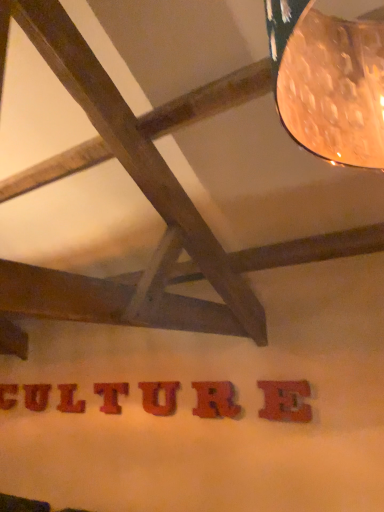
What do you see at coordinates (285, 401) in the screenshot? The height and width of the screenshot is (512, 384). I see `matte red letter e at center, which is the first letter from front to back` at bounding box center [285, 401].

The height and width of the screenshot is (512, 384). I want to click on wooden textured letter t at center, which is the fourth letter in front-to-back order, so click(111, 396).

Measure the distance between point (102, 389) and camera.

The distance of point (102, 389) from camera is 11.58 feet.

How much space does red wood letter at center, which appears as the 3th letter when viewed from the back, occupy vertically?

The height of red wood letter at center, which appears as the 3th letter when viewed from the back, is 10.92 inches.

What do you see at coordinates (70, 400) in the screenshot? This screenshot has height=512, width=384. I see `red wood letter at center, acting as the fifth letter starting from the front` at bounding box center [70, 400].

Locate an element on the screen. The width and height of the screenshot is (384, 512). red wood letter at lower center, placed as the 7th letter when sorted from front to back is located at coordinates (8, 396).

Locate an element on the screen. rubberized red letter r at center, acting as the 6th letter starting from the back is located at coordinates (215, 400).

Is red wood letter at center, arranged as the 2th letter when viewed from the back, facing towards matte red letter e at center, the 1th letter from the right?

No.

You are a GUI agent. You are given a task and a screenshot of the screen. Output one action in this format:
    pyautogui.click(x=<x>, y=<y>)
    Task: Click on the 5th letter counting from the left side of the matte red letter e at center, which is the seventh letter in back-to-front order
    Image resolution: width=384 pixels, height=512 pixels.
    Given the screenshot: What is the action you would take?
    pyautogui.click(x=36, y=396)

From their relative heights in the image, would you say red wood letter at center, arranged as the 6th letter when viewed from the right, is taller or shorter than matte red letter e at center, which is the seventh letter in back-to-front order?

Clearly, red wood letter at center, arranged as the 6th letter when viewed from the right, is shorter compared to matte red letter e at center, which is the seventh letter in back-to-front order.

Can you tell me how much red wood letter at center, the sixth letter viewed from the front, and matte red letter e at center, which is the seventh letter in back-to-front order, differ in facing direction?

The facing directions of red wood letter at center, the sixth letter viewed from the front, and matte red letter e at center, which is the seventh letter in back-to-front order, are 0.00412 degrees apart.

Is point (156, 415) closer to camera compared to point (38, 403)?

Yes.

At what (x,y) coordinates should I click in order to perform the action: click on letter that is the 3rd one when counting leftward from the wooden letter u at center, acting as the third letter starting from the front. Please return your answer as a coordinate pair (x, y). Image resolution: width=384 pixels, height=512 pixels. Looking at the image, I should click on (36, 396).

Does wooden letter u at center, acting as the 5th letter starting from the back, have a lesser height compared to red wood letter at center, the sixth letter viewed from the front?

Incorrect, the height of wooden letter u at center, acting as the 5th letter starting from the back, does not fall short of that of red wood letter at center, the sixth letter viewed from the front.

Could red wood letter at center, arranged as the 2th letter when viewed from the back, be considered to be inside wooden letter u at center, the fifth letter viewed from the left?

No, red wood letter at center, arranged as the 2th letter when viewed from the back, is not surrounded by wooden letter u at center, the fifth letter viewed from the left.

In the scene shown: Which object is further away from the camera taking this photo, matte red letter e at center, which is counted as the 7th letter, starting from the left, or red wood letter at center, the 3th letter when ordered from left to right?

red wood letter at center, the 3th letter when ordered from left to right.

Is matte red letter e at center, the 1th letter from the right, turned away from red wood letter at center, which is the 5th letter in right-to-left order?

That's not correct — matte red letter e at center, the 1th letter from the right, is not looking away from red wood letter at center, which is the 5th letter in right-to-left order.

In the image, is matte red letter e at center, which is the seventh letter in back-to-front order, on the left side or the right side of red wood letter at center, the 3th letter when ordered from left to right?

Based on their positions, matte red letter e at center, which is the seventh letter in back-to-front order, is located to the right of red wood letter at center, the 3th letter when ordered from left to right.

Looking at this image, considering their positions, is wooden textured letter t at center, which is the fourth letter in front-to-back order, located in front of or behind red wood letter at center, acting as the fifth letter starting from the front?

Clearly, wooden textured letter t at center, which is the fourth letter in front-to-back order, is in front of red wood letter at center, acting as the fifth letter starting from the front.

Based on the photo, from a real-world perspective, relative to red wood letter at center, which appears as the 3th letter when viewed from the back, is wooden textured letter t at center, which is the fourth letter in front-to-back order, vertically above or below?

Clearly, from a real-world perspective, wooden textured letter t at center, which is the fourth letter in front-to-back order, is above red wood letter at center, which appears as the 3th letter when viewed from the back.

Considering the sizes of objects wooden textured letter t at center, which appears as the 4th letter when viewed from the left, and red wood letter at center, which is the 5th letter in right-to-left order, in the image provided, who is wider, wooden textured letter t at center, which appears as the 4th letter when viewed from the left, or red wood letter at center, which is the 5th letter in right-to-left order,?

With larger width is red wood letter at center, which is the 5th letter in right-to-left order.

Are red wood letter at lower center, marked as the first letter in a back-to-front arrangement, and red wood letter at center, the sixth letter viewed from the front, far apart?

No, red wood letter at lower center, marked as the first letter in a back-to-front arrangement, is not far away from red wood letter at center, the sixth letter viewed from the front.

Would you say red wood letter at lower center, marked as the first letter in a back-to-front arrangement, is outside red wood letter at center, arranged as the 6th letter when viewed from the right?

Yes, red wood letter at lower center, marked as the first letter in a back-to-front arrangement, is outside of red wood letter at center, arranged as the 6th letter when viewed from the right.

In order to click on letter below the red wood letter at center, arranged as the 6th letter when viewed from the right (from the image's perspective) in this screenshot , I will do `click(8, 396)`.

Based on the photo, can you confirm if matte red letter e at center, which is the seventh letter in back-to-front order, is smaller than wooden letter u at center, acting as the 5th letter starting from the back?

No, matte red letter e at center, which is the seventh letter in back-to-front order, is not smaller than wooden letter u at center, acting as the 5th letter starting from the back.

Is matte red letter e at center, the 1th letter from the right, positioned beyond the bounds of wooden letter u at center, acting as the third letter starting from the front?

Yes.

Which is more to the left, matte red letter e at center, which is counted as the 7th letter, starting from the left, or wooden letter u at center, acting as the 5th letter starting from the back?

wooden letter u at center, acting as the 5th letter starting from the back, is more to the left.

Considering the relative positions of matte red letter e at center, which is counted as the 7th letter, starting from the left, and wooden letter u at center, acting as the third letter starting from the front, in the image provided, is matte red letter e at center, which is counted as the 7th letter, starting from the left, in front of wooden letter u at center, acting as the third letter starting from the front,?

Yes, it is in front of wooden letter u at center, acting as the third letter starting from the front.

Is wooden textured letter t at center, which is the fourth letter in front-to-back order, taller than red wood letter at lower center, the 7th letter positioned from the right?

Indeed, wooden textured letter t at center, which is the fourth letter in front-to-back order, has a greater height compared to red wood letter at lower center, the 7th letter positioned from the right.

Looking at this image, can you confirm if wooden textured letter t at center, which appears as the 4th letter when viewed from the left, is bigger than red wood letter at lower center, placed as the 7th letter when sorted from front to back?

Incorrect, wooden textured letter t at center, which appears as the 4th letter when viewed from the left, is not larger than red wood letter at lower center, placed as the 7th letter when sorted from front to back.

From a real-world perspective, who is located lower, wooden textured letter t at center, which ranks as the 4th letter in right-to-left order, or red wood letter at lower center, placed as the 7th letter when sorted from front to back?

From a 3D spatial view, red wood letter at lower center, placed as the 7th letter when sorted from front to back, is below.

Could you measure the distance between wooden textured letter t at center, which appears as the 4th letter when viewed from the left, and red wood letter at lower center, placed as the 7th letter when sorted from front to back?

1.21 meters.

From the matte red letter e at center, which is counted as the 7th letter, starting from the left, count the 5th letter to the left and point to it. Please provide its 2D coordinates.

[(36, 396)]

From the red wood letter at center, marked as the second letter in a left-to-right arrangement, count 3rd letters forward and point to it. Please provide its 2D coordinates.

[(159, 397)]

Consider the image. Estimate the real-world distances between objects in this image. Which object is further from rubberized red letter r at center, acting as the 6th letter starting from the left, matte red letter e at center, which is counted as the 7th letter, starting from the left, or wooden letter u at center, acting as the 5th letter starting from the back?

The object further to rubberized red letter r at center, acting as the 6th letter starting from the left, is matte red letter e at center, which is counted as the 7th letter, starting from the left.

Based on the photo, estimate the real-world distances between objects in this image. Which object is closer to red wood letter at lower center, marked as the first letter in a back-to-front arrangement, red wood letter at center, the 3th letter when ordered from left to right, or rubberized red letter r at center, acting as the 6th letter starting from the left?

red wood letter at center, the 3th letter when ordered from left to right.

Looking at the image, which one is located closer to wooden letter u at center, the fifth letter viewed from the left, red wood letter at center, marked as the second letter in a left-to-right arrangement, or red wood letter at center, which appears as the 3th letter when viewed from the back?

red wood letter at center, which appears as the 3th letter when viewed from the back, is closer to wooden letter u at center, the fifth letter viewed from the left.

Based on their spatial positions, is red wood letter at lower center, placed as the 7th letter when sorted from front to back, or red wood letter at center, which is the 5th letter in right-to-left order, further from red wood letter at center, the sixth letter viewed from the front?

red wood letter at lower center, placed as the 7th letter when sorted from front to back, is positioned further to the anchor red wood letter at center, the sixth letter viewed from the front.

Which object lies nearer to the anchor point red wood letter at lower center, the 1th letter from the left, rubberized red letter r at center, the second letter positioned from the front, or matte red letter e at center, the 1th letter from the right?

rubberized red letter r at center, the second letter positioned from the front.

Considering their positions, is red wood letter at center, acting as the fifth letter starting from the front, positioned closer to wooden textured letter t at center, which appears as the 4th letter when viewed from the left, than rubberized red letter r at center, which appears as the 2th letter when viewed from the right?

Among the two, red wood letter at center, acting as the fifth letter starting from the front, is located nearer to wooden textured letter t at center, which appears as the 4th letter when viewed from the left.

Considering their positions, is rubberized red letter r at center, the second letter positioned from the front, positioned closer to red wood letter at lower center, marked as the first letter in a back-to-front arrangement, than red wood letter at center, which appears as the 3th letter when viewed from the back?

Based on the image, red wood letter at center, which appears as the 3th letter when viewed from the back, appears to be nearer to red wood letter at lower center, marked as the first letter in a back-to-front arrangement.

From the image, which object appears to be farther from red wood letter at center, the sixth letter viewed from the front, matte red letter e at center, the 1th letter from the right, or red wood letter at center, which is the 5th letter in right-to-left order?

Based on the image, matte red letter e at center, the 1th letter from the right, appears to be further to red wood letter at center, the sixth letter viewed from the front.

Locate an element on the screen. letter between red wood letter at center, arranged as the 6th letter when viewed from the right, and wooden textured letter t at center, which ranks as the 4th letter in right-to-left order is located at coordinates (70, 400).

The width and height of the screenshot is (384, 512). I want to click on letter between wooden letter u at center, acting as the 5th letter starting from the back, and matte red letter e at center, which is counted as the 7th letter, starting from the left, so click(215, 400).

This screenshot has width=384, height=512. In order to click on letter between red wood letter at center, which appears as the 3th letter when viewed from the back, and wooden letter u at center, marked as the 3th letter in a right-to-left arrangement, from left to right in this screenshot , I will do pos(111,396).

Identify the location of letter situated between wooden textured letter t at center, which appears as the 4th letter when viewed from the left, and rubberized red letter r at center, the second letter positioned from the front, from left to right. The width and height of the screenshot is (384, 512). (159, 397).